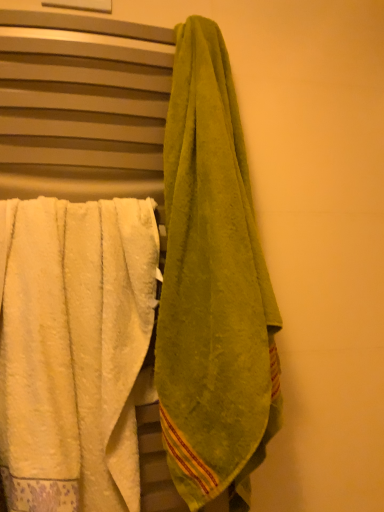
Question: Would you say green terry cloth towel at right, positioned as the 2th towel in left-to-right order, is to the left or to the right of white fluffy towel at left, the 2th towel viewed from the right, in the picture?

Choices:
 (A) left
 (B) right

Answer: (B)

Question: Considering their positions, is green terry cloth towel at right, positioned as the 2th towel in left-to-right order, located in front of or behind white fluffy towel at left, the 2th towel viewed from the right?

Choices:
 (A) front
 (B) behind

Answer: (A)

Question: Based on their relative distances, which object is nearer to the green terry cloth towel at right, which appears as the 1th towel when viewed from the right?

Choices:
 (A) green cotton towel at right
 (B) white fluffy towel at left, marked as the 1th towel in a left-to-right arrangement

Answer: (A)

Question: Which is nearer to the white fluffy towel at left, the 2th towel viewed from the right?

Choices:
 (A) green terry cloth towel at right, which appears as the 1th towel when viewed from the right
 (B) green cotton towel at right

Answer: (B)